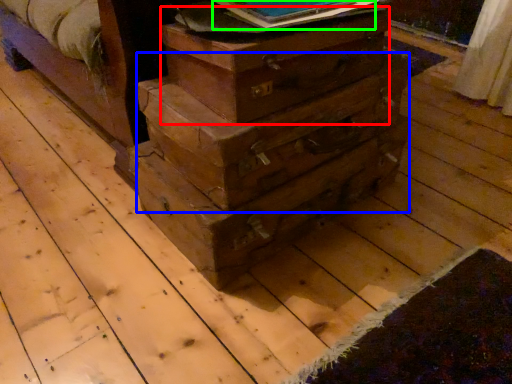
Question: Estimate the real-world distances between objects in this image. Which object is closer to crate (highlighted by a red box), drawer (highlighted by a blue box) or paperback book (highlighted by a green box)?

Choices:
 (A) drawer
 (B) paperback book

Answer: (A)